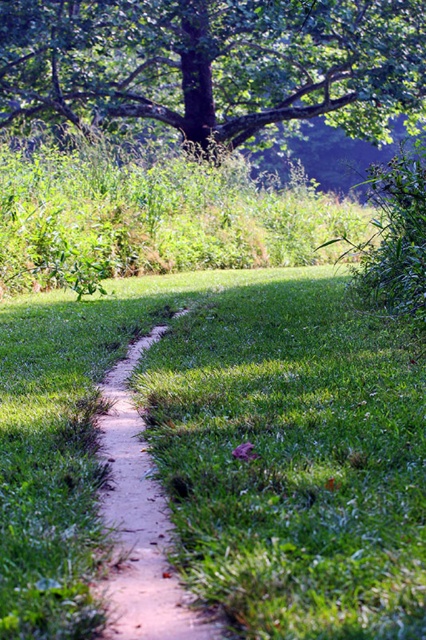
Question: Which of the following is the closest to the observer?

Choices:
 (A) (265, 438)
 (B) (190, 20)

Answer: (A)

Question: Can you confirm if green grassy at center is bigger than green leafy tree at upper center?

Choices:
 (A) yes
 (B) no

Answer: (B)

Question: In this image, where is green grassy at center located relative to green leafy tree at upper center?

Choices:
 (A) right
 (B) left

Answer: (A)

Question: Can you confirm if green grassy at center is bigger than green leafy tree at upper center?

Choices:
 (A) no
 (B) yes

Answer: (A)

Question: Which of the following is the closest to the observer?

Choices:
 (A) (319, 106)
 (B) (261, 369)

Answer: (B)

Question: Which point is closer to the camera taking this photo?

Choices:
 (A) click(385, 593)
 (B) click(282, 35)

Answer: (A)